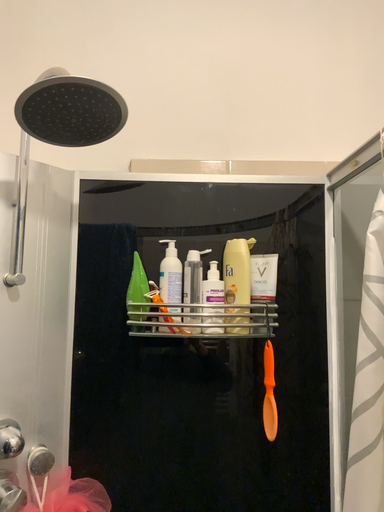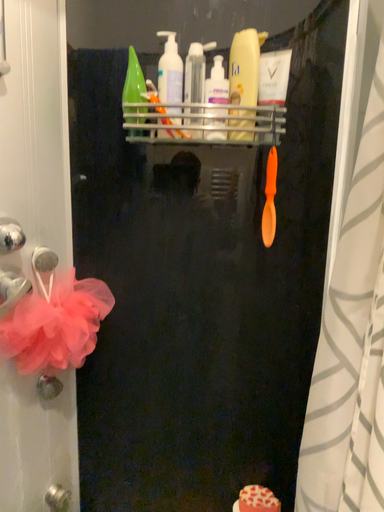
Question: Which way did the camera rotate in the video?

Choices:
 (A) rotated upward
 (B) rotated downward

Answer: (B)